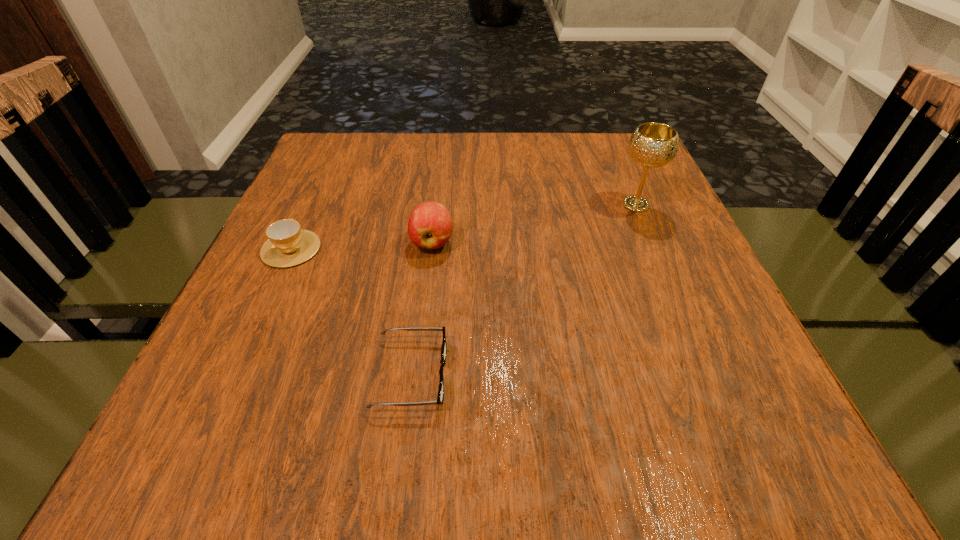
This screenshot has height=540, width=960. I want to click on chalice, so click(x=652, y=145).

Identify the location of the farthest object. (652, 145).

Image resolution: width=960 pixels, height=540 pixels. Identify the location of apple. (430, 225).

Find the location of a particular element. the leftmost object is located at coordinates (288, 245).

Image resolution: width=960 pixels, height=540 pixels. I want to click on cup, so click(288, 245).

Locate an element on the screen. This screenshot has height=540, width=960. the shortest object is located at coordinates (440, 397).

At what (x,y) coordinates should I click in order to perform the action: click on the nearest object. Please return your answer as a coordinate pair (x, y). Looking at the image, I should click on (440, 397).

Identify the location of vacant space positioned on the back of the tallest object. (618, 163).

At what (x,y) coordinates should I click in order to perform the action: click on vacant area situated on the left of the third shortest object. Please return your answer as a coordinate pair (x, y). This screenshot has height=540, width=960. Looking at the image, I should click on (350, 242).

The image size is (960, 540). Identify the location of vacant space located with the handle on the side of the second shortest object. (341, 139).